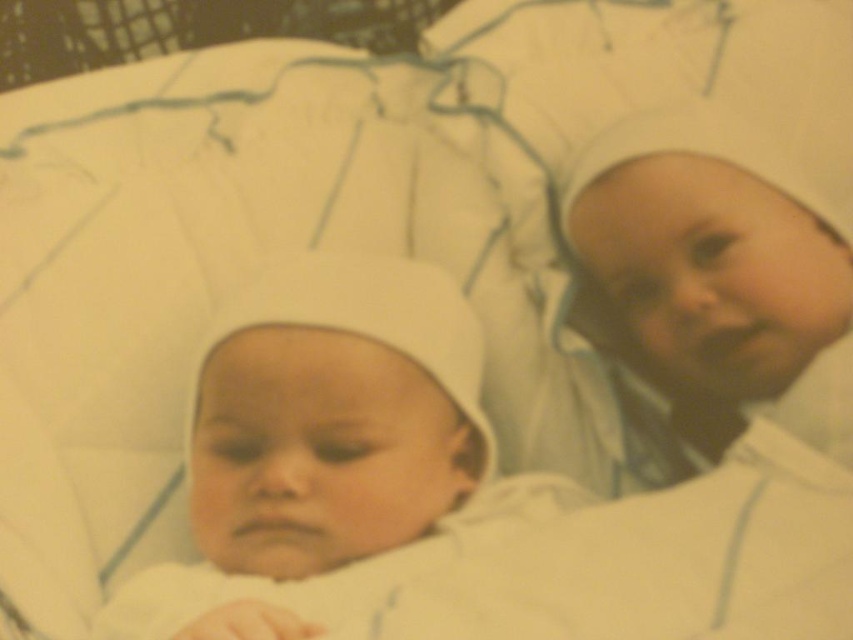
Does white soft fabric newborn at lower left have a lesser height compared to white soft fabric newborn at right?

Yes.

Is white soft fabric newborn at lower left below white soft fabric newborn at right?

Correct, white soft fabric newborn at lower left is located below white soft fabric newborn at right.

Is point (106, 632) farther from camera compared to point (614, 285)?

No, (106, 632) is closer to viewer.

Locate an element on the screen. white soft fabric newborn at lower left is located at coordinates (329, 452).